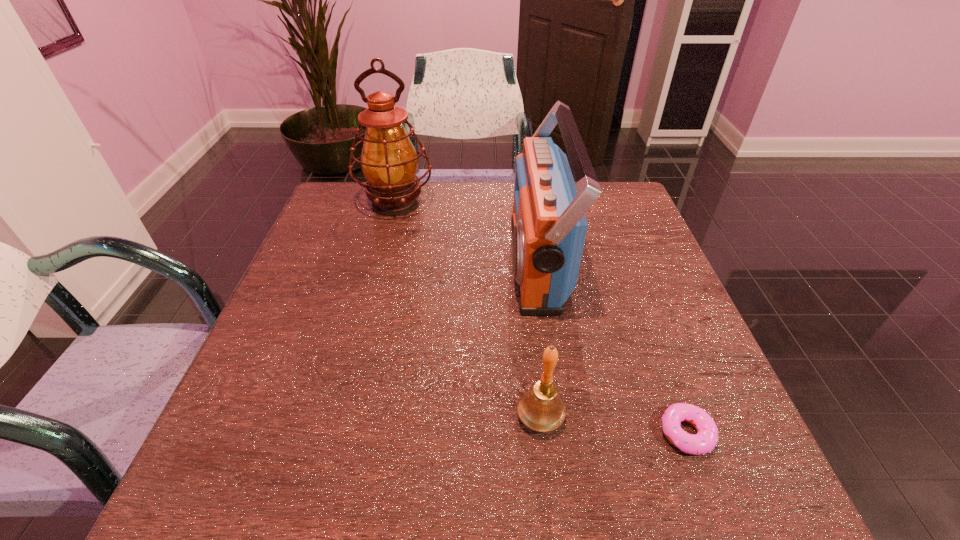
Identify the location of free space at the near edge of the desktop. The width and height of the screenshot is (960, 540). (571, 483).

The image size is (960, 540). Identify the location of vacant area at the left edge. (352, 247).

Where is `free space at the right edge`? Image resolution: width=960 pixels, height=540 pixels. free space at the right edge is located at coordinates (620, 275).

The image size is (960, 540). Identify the location of vacant space at the far left corner of the desktop. coord(349,210).

This screenshot has width=960, height=540. What are the coordinates of `free point at the far right corner` in the screenshot? It's located at (630, 221).

Image resolution: width=960 pixels, height=540 pixels. Find the location of `free point at the near right corner`. free point at the near right corner is located at coordinates (698, 491).

The width and height of the screenshot is (960, 540). I want to click on unoccupied area between the leftmost object and the third tallest object, so click(468, 310).

I want to click on free space between the second tallest object and the rightmost object, so click(x=612, y=348).

Image resolution: width=960 pixels, height=540 pixels. I want to click on blank region between the tallest object and the bell, so click(468, 310).

Where is `unoccupied area between the oil lamp and the third shortest object`? Image resolution: width=960 pixels, height=540 pixels. unoccupied area between the oil lamp and the third shortest object is located at coordinates (467, 233).